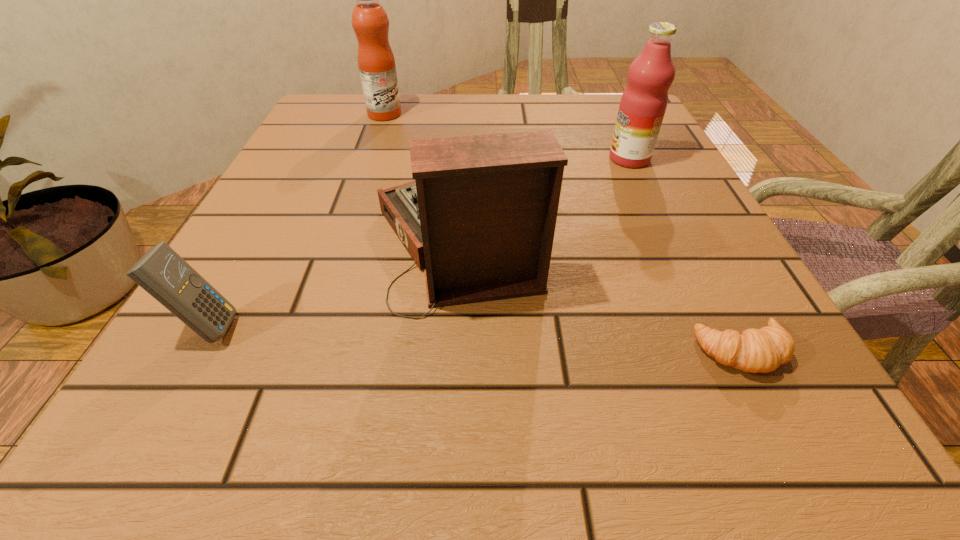
The width and height of the screenshot is (960, 540). Find the location of `unoccupied area between the shortest object and the leftmost object`. unoccupied area between the shortest object and the leftmost object is located at coordinates (475, 339).

Image resolution: width=960 pixels, height=540 pixels. What are the coordinates of `free space that is in between the third object from left to right and the calculator` in the screenshot? It's located at (333, 282).

Select which object appears as the third closest to the farthest object. Please provide its 2D coordinates. Your answer should be formatted as a tuple, i.e. [(x, y)], where the tuple contains the x and y coordinates of a point satisfying the conditions above.

[(166, 276)]

Select which object is the third closest to the left fruit juice. Please provide its 2D coordinates. Your answer should be formatted as a tuple, i.e. [(x, y)], where the tuple contains the x and y coordinates of a point satisfying the conditions above.

[(166, 276)]

Identify the location of vacant space that satisfies the following two spatial constraints: 1. on the front label of the left fruit juice; 2. on the back side of the third object from left to right. The width and height of the screenshot is (960, 540). (342, 238).

The width and height of the screenshot is (960, 540). I want to click on free space that satisfies the following two spatial constraints: 1. on the front-facing side of the leftmost object; 2. on the back side of the shortest object, so click(x=195, y=351).

This screenshot has height=540, width=960. Find the location of `vacant space that satisfies the following two spatial constraints: 1. on the front label of the left fruit juice; 2. on the back side of the phonograph record`. vacant space that satisfies the following two spatial constraints: 1. on the front label of the left fruit juice; 2. on the back side of the phonograph record is located at coordinates (342, 238).

At what (x,y) coordinates should I click in order to perform the action: click on vacant area in the image that satisfies the following two spatial constraints: 1. on the front-facing side of the shortest object; 2. on the right side of the calculator. Please return your answer as a coordinate pair (x, y). The image size is (960, 540). Looking at the image, I should click on (195, 351).

Locate an element on the screen. The width and height of the screenshot is (960, 540). vacant area in the image that satisfies the following two spatial constraints: 1. on the back side of the shortest object; 2. on the front-facing side of the calculator is located at coordinates (729, 326).